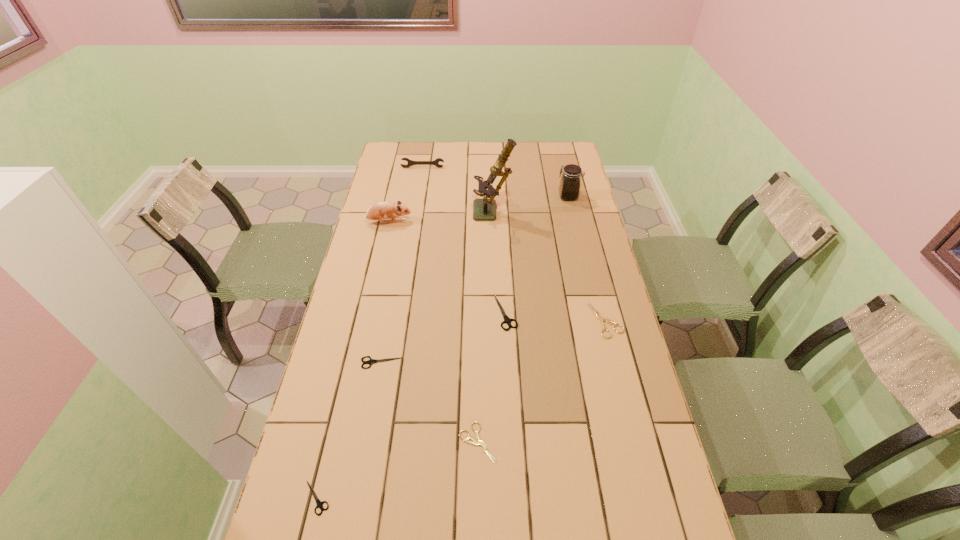
Find the location of a particular element. free space between the farther beige shears and the tallest object is located at coordinates (549, 267).

The image size is (960, 540). Identify the location of free space between the fifth tallest object and the smaller beige shears. (492, 377).

At what (x,y) coordinates should I click in order to perform the action: click on vacant space that's between the rightmost shears and the eighth shortest object. Please return your answer as a coordinate pair (x, y). The image size is (960, 540). Looking at the image, I should click on (587, 259).

Locate an element on the screen. This screenshot has height=540, width=960. free spot between the brown microscope and the seventh farthest object is located at coordinates (437, 288).

Locate an element on the screen. The image size is (960, 540). blank region between the nearer beige shears and the smallest black shears is located at coordinates (397, 470).

Find the location of a particular element. unoccupied position between the smaller beige shears and the brown hamster is located at coordinates (433, 332).

Locate an element on the screen. object that is the third closest to the nearer beige shears is located at coordinates (507, 320).

Identify which object is the fifth nearest to the jar. Please provide its 2D coordinates. Your answer should be formatted as a tuple, i.e. [(x, y)], where the tuple contains the x and y coordinates of a point satisfying the conditions above.

[(382, 210)]

Locate an element on the screen. Image resolution: width=960 pixels, height=540 pixels. shears that stands as the fourth closest to the fifth shortest object is located at coordinates (319, 503).

Identify which shears is the fourth closest to the eighth shortest object. Please provide its 2D coordinates. Your answer should be formatted as a tuple, i.e. [(x, y)], where the tuple contains the x and y coordinates of a point satisfying the conditions above.

[(474, 442)]